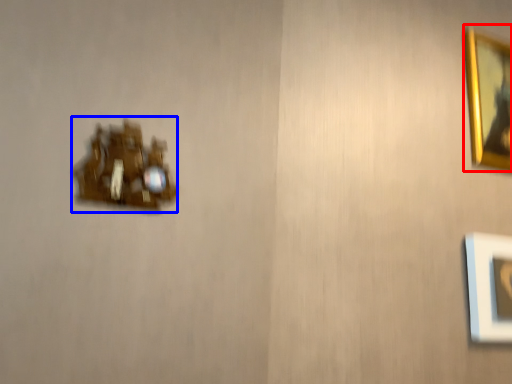
Question: Which point is further to the camera, picture frame (highlighted by a red box) or portrait (highlighted by a blue box)?

Choices:
 (A) picture frame
 (B) portrait

Answer: (A)